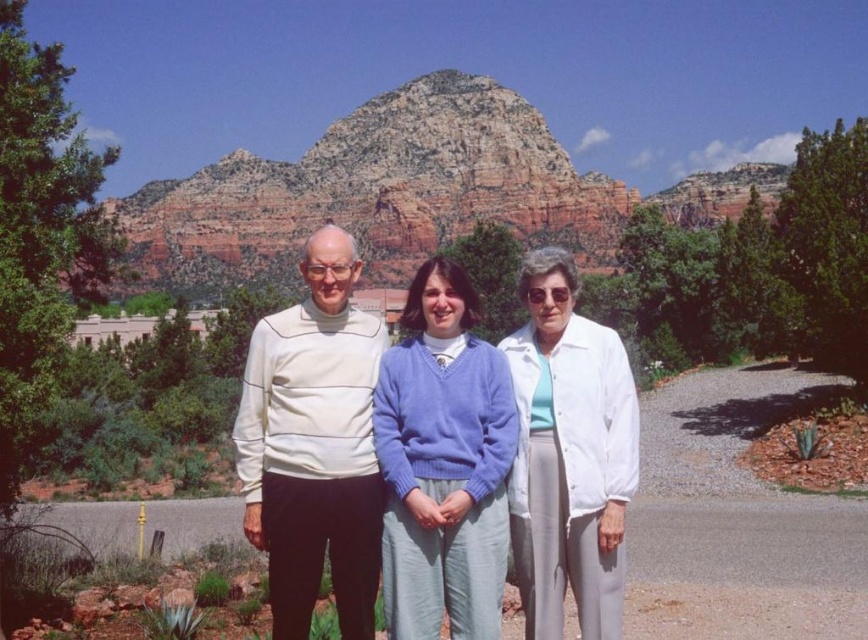
You are a photographer trying to capture a clear shot of the matte blue sweater at center and the rustic rock formation at center. Which object is blocking the view of the other?

The matte blue sweater at center is behind the rustic rock formation at center, so the rustic rock formation at center is blocking the view of the matte blue sweater at center.

Looking at this image, you are an artist planning to paint the scene. You want to ensure the rustic rock formation at center and the matte blue sweater at center are proportionally accurate. Which object should you make larger in your painting?

The rustic rock formation at center should be depicted as larger than the matte blue sweater at center in the painting since it is described as larger in size according to the scene description.